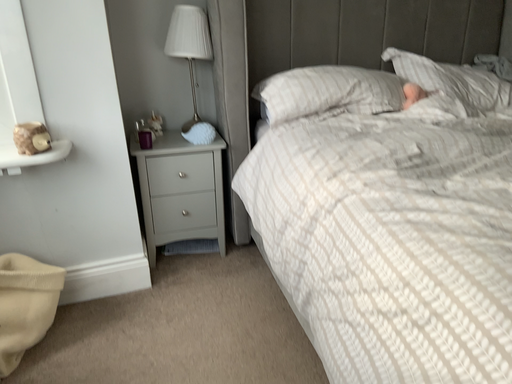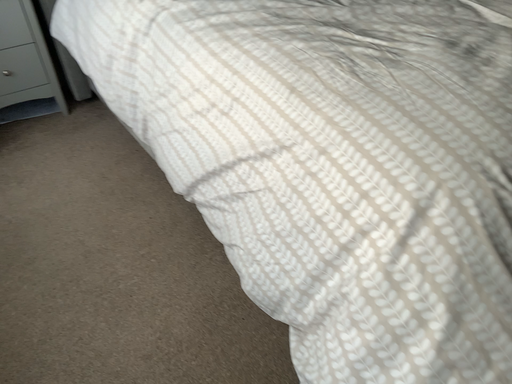
Question: How did the camera likely rotate when shooting the video?

Choices:
 (A) rotated downward
 (B) rotated upward

Answer: (A)